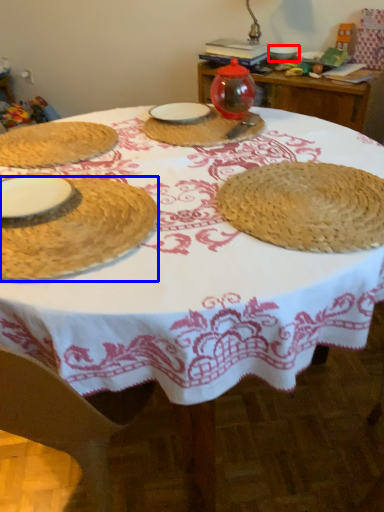
Question: Which object appears closest to the camera in this image, tableware (highlighted by a red box) or tableware (highlighted by a blue box)?

Choices:
 (A) tableware
 (B) tableware

Answer: (B)